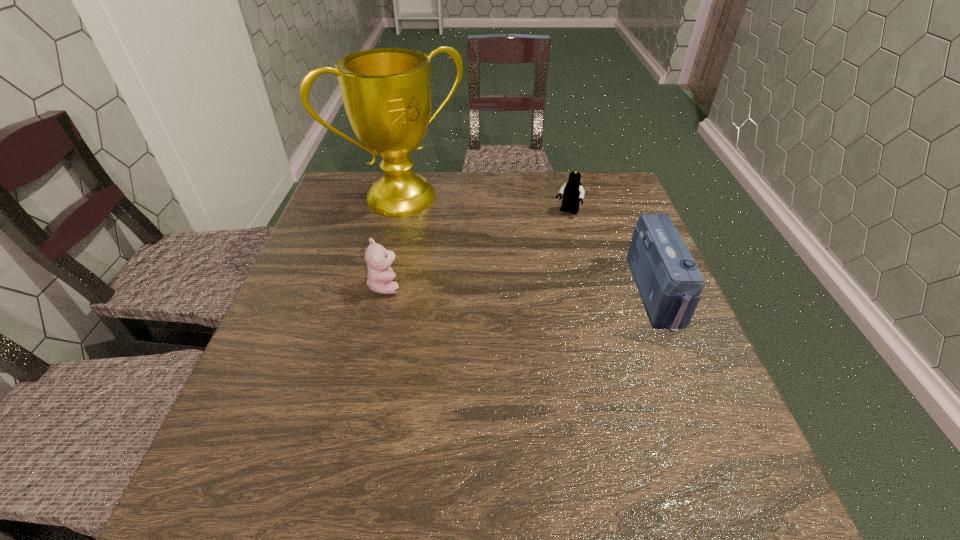
The image size is (960, 540). Find the location of `vacant area at the left edge`. vacant area at the left edge is located at coordinates (338, 263).

In the image, there is a desktop. Where is `free space at the right edge`? This screenshot has height=540, width=960. free space at the right edge is located at coordinates (661, 364).

Locate an element on the screen. The width and height of the screenshot is (960, 540). vacant region at the far left corner of the desktop is located at coordinates (347, 185).

Where is `vacant space at the near left corner of the desktop`? The height and width of the screenshot is (540, 960). vacant space at the near left corner of the desktop is located at coordinates (292, 407).

In the image, there is a desktop. Where is `vacant space at the far right corner`? The height and width of the screenshot is (540, 960). vacant space at the far right corner is located at coordinates (615, 179).

Identify the location of blank region between the camera and the teddy bear. The height and width of the screenshot is (540, 960). (521, 289).

The height and width of the screenshot is (540, 960). I want to click on free space between the camera and the award, so click(531, 245).

The image size is (960, 540). What are the coordinates of `unoccupied area between the teddy bear and the camera` in the screenshot? It's located at click(x=521, y=289).

Find the location of a particular element. The image size is (960, 540). vacant point located between the award and the Lego is located at coordinates (486, 205).

Image resolution: width=960 pixels, height=540 pixels. I want to click on vacant area that lies between the teddy bear and the tallest object, so point(395,241).